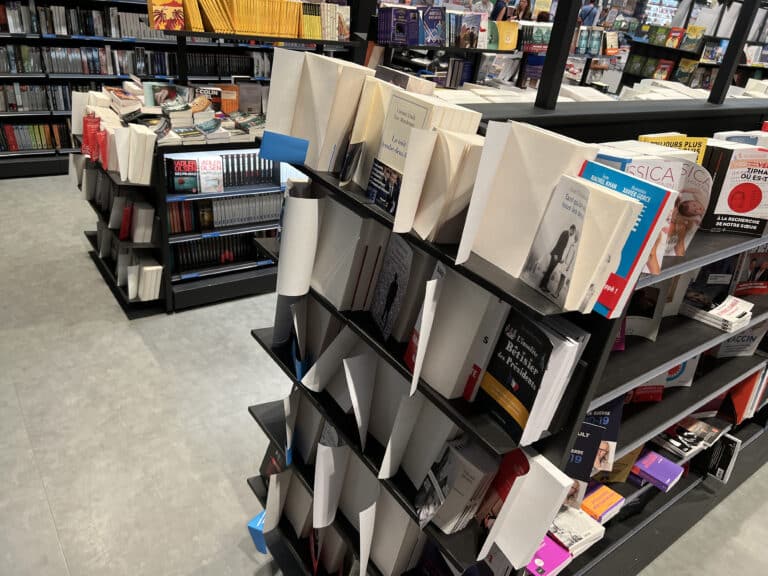
Locate an element on the screen. This screenshot has height=576, width=768. orange books is located at coordinates 249,20.